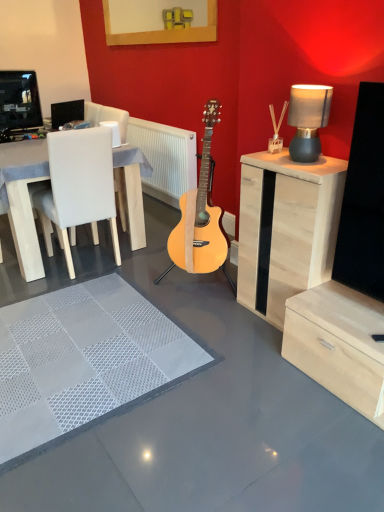
I want to click on vacant area situated to the left side of matte gray lampshade at upper right, so click(275, 157).